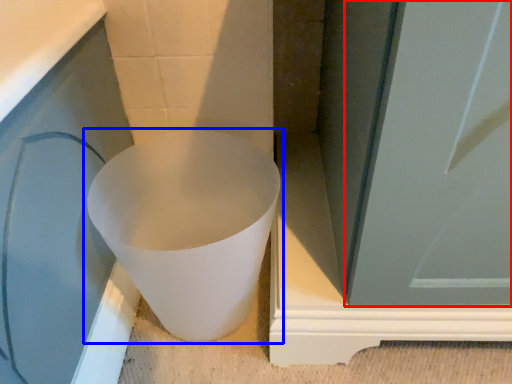
Question: Which point is closer to the camera, screen door (highlighted by a red box) or toilet (highlighted by a blue box)?

Choices:
 (A) screen door
 (B) toilet

Answer: (A)